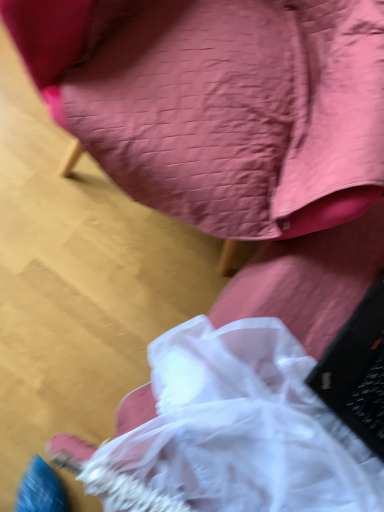
Question: Looking at the image, does black matte laptop at lower right seem bigger or smaller compared to matte pink fabric chair at upper center?

Choices:
 (A) big
 (B) small

Answer: (B)

Question: In terms of width, does black matte laptop at lower right look wider or thinner when compared to matte pink fabric chair at upper center?

Choices:
 (A) wide
 (B) thin

Answer: (B)

Question: Is black matte laptop at lower right in front of or behind matte pink fabric chair at upper center in the image?

Choices:
 (A) front
 (B) behind

Answer: (B)

Question: Considering the positions of point (316, 156) and point (339, 369), is point (316, 156) closer or farther from the camera than point (339, 369)?

Choices:
 (A) farther
 (B) closer

Answer: (B)

Question: Is matte pink fabric chair at upper center taller or shorter than black matte laptop at lower right?

Choices:
 (A) tall
 (B) short

Answer: (A)

Question: From a real-world perspective, is matte pink fabric chair at upper center above or below black matte laptop at lower right?

Choices:
 (A) above
 (B) below

Answer: (A)

Question: Would you say matte pink fabric chair at upper center is inside or outside black matte laptop at lower right?

Choices:
 (A) outside
 (B) inside

Answer: (A)